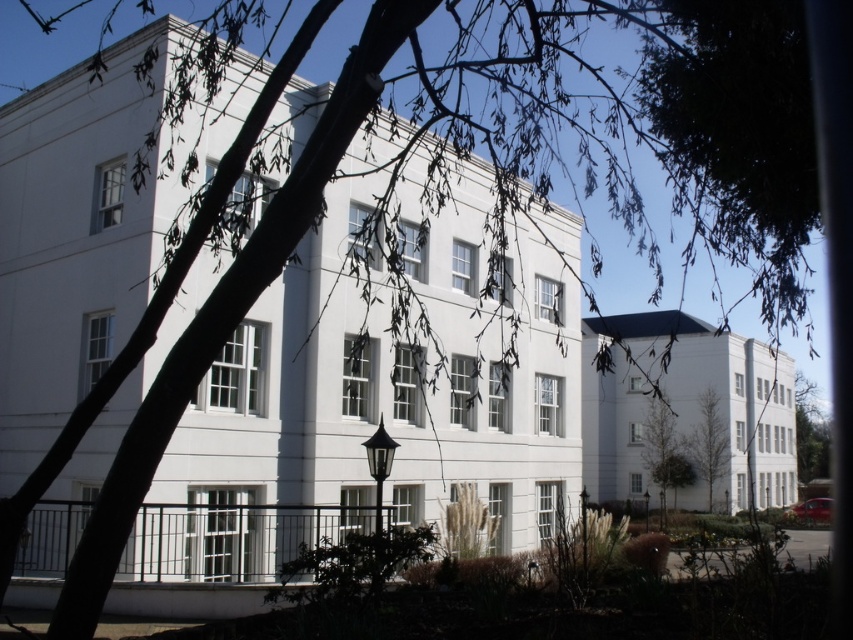
Can you confirm if green leafy tree at lower right is taller than green leafy tree at right?

No, green leafy tree at lower right is not taller than green leafy tree at right.

Between green leafy tree at lower right and green leafy tree at right, which one appears on the right side from the viewer's perspective?

green leafy tree at right

Is point (646, 468) closer to viewer compared to point (815, 422)?

Yes, point (646, 468) is closer to viewer.

In order to click on green leafy tree at lower right in this screenshot , I will do `click(663, 451)`.

Can you confirm if green leafy tree at lower right is positioned below green leafy tree at center?

A: Indeed, green leafy tree at lower right is positioned under green leafy tree at center.

Between point (656, 452) and point (712, 458), which one is positioned behind?

Point (656, 452)

Between point (675, 442) and point (701, 412), which one is positioned behind?

The point (675, 442) is more distant.

Where is `green leafy tree at lower right`? green leafy tree at lower right is located at coordinates (663, 451).

Can you confirm if green leafy tree at center is wider than green leafy tree at right?

No.

Who is shorter, green leafy tree at center or green leafy tree at right?

green leafy tree at center

Which is behind, point (689, 445) or point (815, 426)?

The point (815, 426) is behind.

The image size is (853, 640). What are the coordinates of `green leafy tree at center` in the screenshot? It's located at (708, 444).